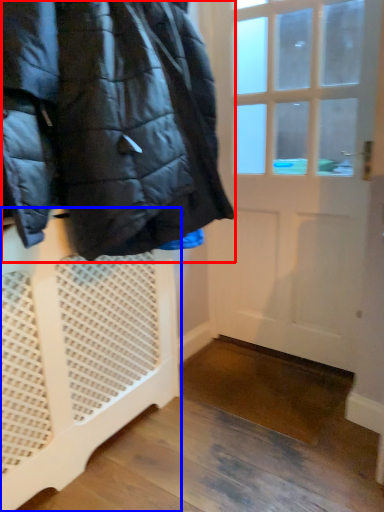
Question: Which object appears farthest to the camera in this image, jacket (highlighted by a red box) or furniture (highlighted by a blue box)?

Choices:
 (A) jacket
 (B) furniture

Answer: (B)